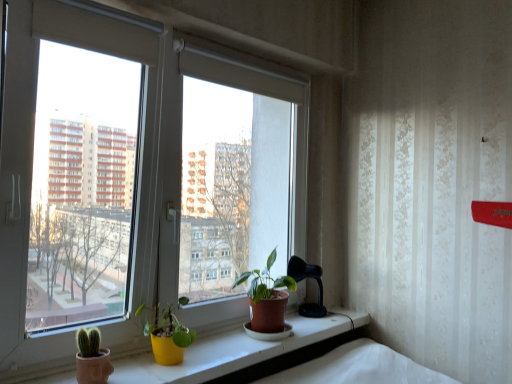
Image resolution: width=512 pixels, height=384 pixels. I want to click on vacant space in matte brown pot at center, placed as the first houseplant when sorted from right to left (from a real-world perspective), so click(272, 339).